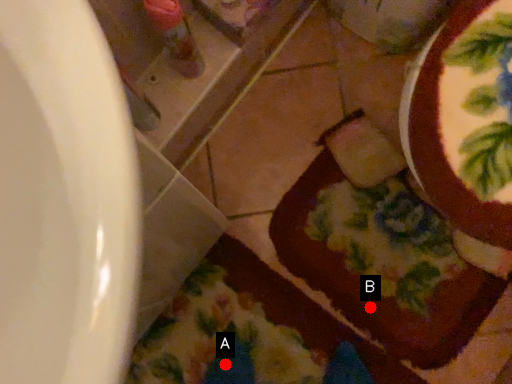
Question: Two points are circled on the image, labeled by A and B beside each circle. Which point is closer to the camera taking this photo?

Choices:
 (A) A is closer
 (B) B is closer

Answer: (A)